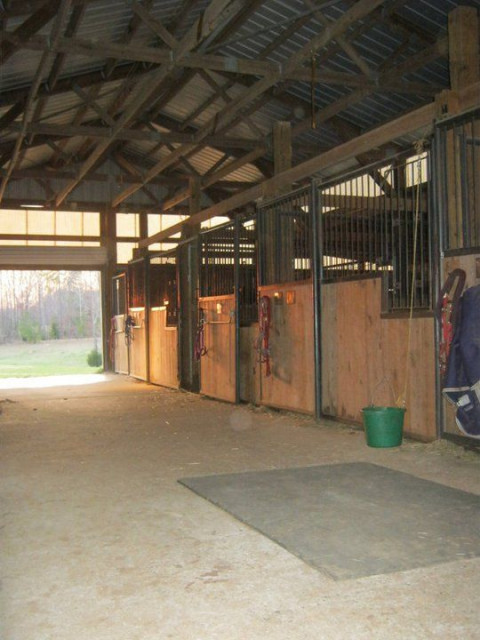
Where is `grey mat`? Image resolution: width=480 pixels, height=640 pixels. grey mat is located at coordinates (380, 523).